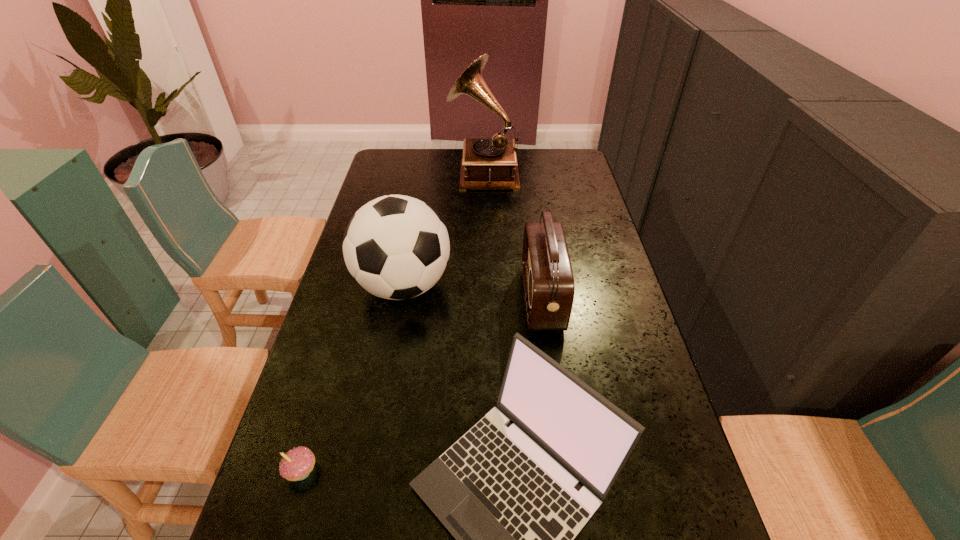
Identify which object is located as the nearest to the laptop_computer. Please provide its 2D coordinates. Your answer should be formatted as a tuple, i.e. [(x, y)], where the tuple contains the x and y coordinates of a point satisfying the conditions above.

[(548, 281)]

Select which object appears as the third closest to the radio receiver. Please provide its 2D coordinates. Your answer should be formatted as a tuple, i.e. [(x, y)], where the tuple contains the x and y coordinates of a point satisfying the conditions above.

[(492, 163)]

The height and width of the screenshot is (540, 960). I want to click on free point that satisfies the following two spatial constraints: 1. on the front panel of the radio receiver; 2. on the front side of the shortest object, so click(565, 471).